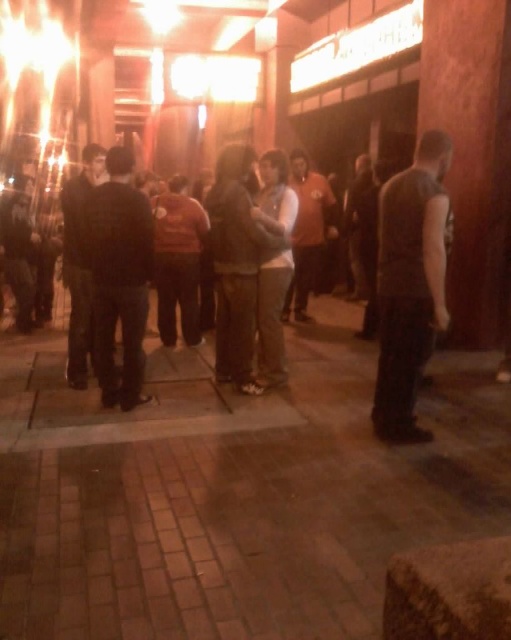
Is dark gray vest at right in front of dark gray sweater at center?

That is True.

Can you confirm if dark gray vest at right is wider than dark gray sweater at center?

In fact, dark gray vest at right might be narrower than dark gray sweater at center.

Describe the element at coordinates (409, 285) in the screenshot. I see `dark gray vest at right` at that location.

At what (x,y) coordinates should I click in order to perform the action: click on dark gray vest at right. Please return your answer as a coordinate pair (x, y). Looking at the image, I should click on click(x=409, y=285).